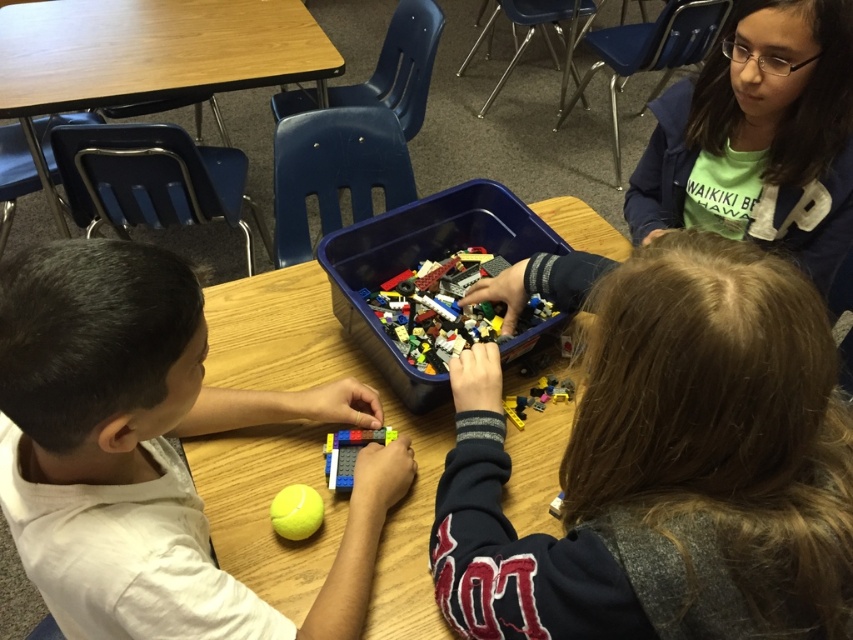
Question: Estimate the real-world distances between objects in this image. Which object is closer to the matte plastic lego at center?

Choices:
 (A) yellow rubber tennis ball at lower center
 (B) wooden table at center

Answer: (B)

Question: Where is wooden table at center located in relation to yellow rubber tennis ball at lower center in the image?

Choices:
 (A) below
 (B) above

Answer: (B)

Question: Which point is farther to the camera?

Choices:
 (A) translucent plastic lego at center
 (B) matte plastic lego at center

Answer: (A)

Question: Which object appears closest to the camera in this image?

Choices:
 (A) translucent plastic lego bricks at center
 (B) translucent plastic lego at lower center

Answer: (B)

Question: Is translucent plastic lego bricks at center smaller than translucent plastic lego at lower center?

Choices:
 (A) no
 (B) yes

Answer: (A)

Question: Does wooden table at center have a larger size compared to translucent plastic lego at center?

Choices:
 (A) no
 (B) yes

Answer: (B)